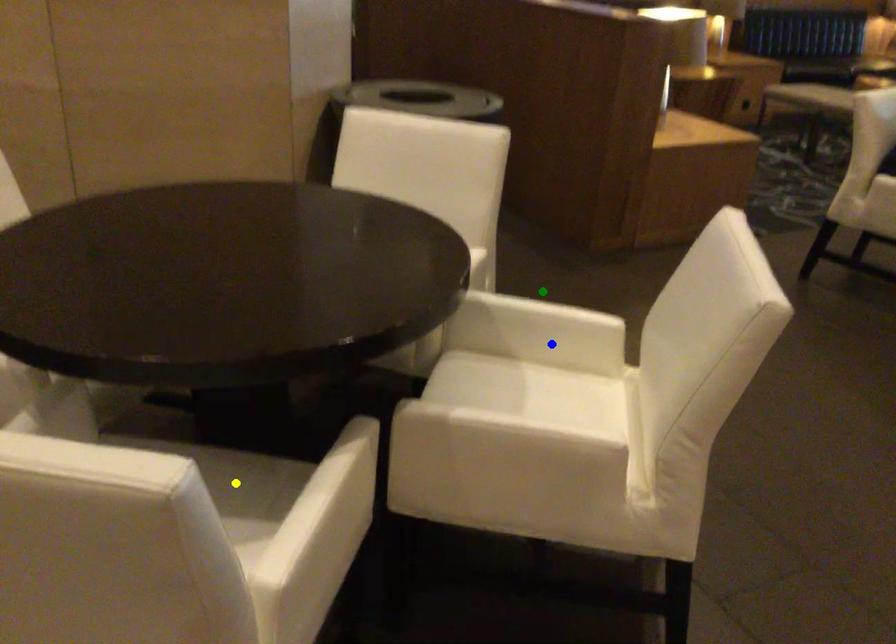
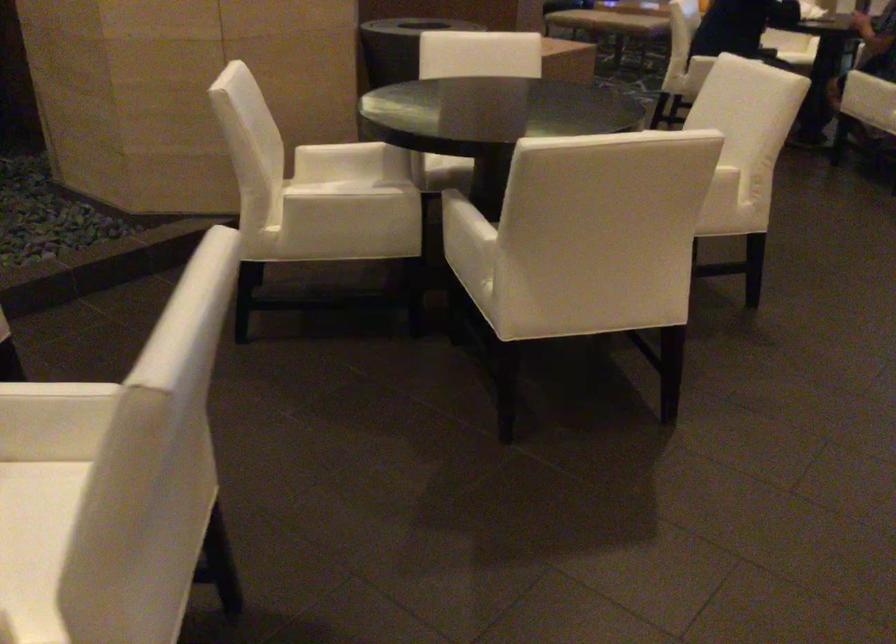
I am providing you with two images of the same scene from different viewpoints. Three points are marked in image1. Which point corresponds to a part or object that is occluded in image2?In image1, three points are marked. Which of them correspond to a part or object that is occluded in image2?Among the three points shown in image1, which one corresponds to a part or object that is no longer visible due to occlusion in image2?

Invisible in image2: green point, blue point, yellow point.